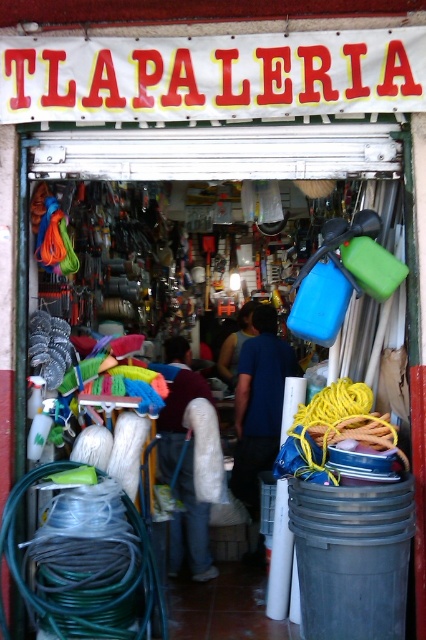
Question: Can you confirm if green rubber hose at lower left is wider than blue fabric shirt at center?

Choices:
 (A) yes
 (B) no

Answer: (A)

Question: Is blue fabric at center to the right of maroon fabric at center from the viewer's perspective?

Choices:
 (A) no
 (B) yes

Answer: (B)

Question: Is green rubber hose at lower left smaller than blue fabric shirt at center?

Choices:
 (A) yes
 (B) no

Answer: (B)

Question: Estimate the real-world distances between objects in this image. Which object is closer to the blue fabric at center?

Choices:
 (A) maroon fabric at center
 (B) blue fabric shirt at center
 (C) green rubber hose at lower left

Answer: (A)

Question: Which point appears closest to the camera in this image?

Choices:
 (A) (244, 323)
 (B) (178, 481)
 (C) (279, 353)

Answer: (B)

Question: Which object appears closest to the camera in this image?

Choices:
 (A) blue fabric at center
 (B) green rubber hose at lower left

Answer: (B)